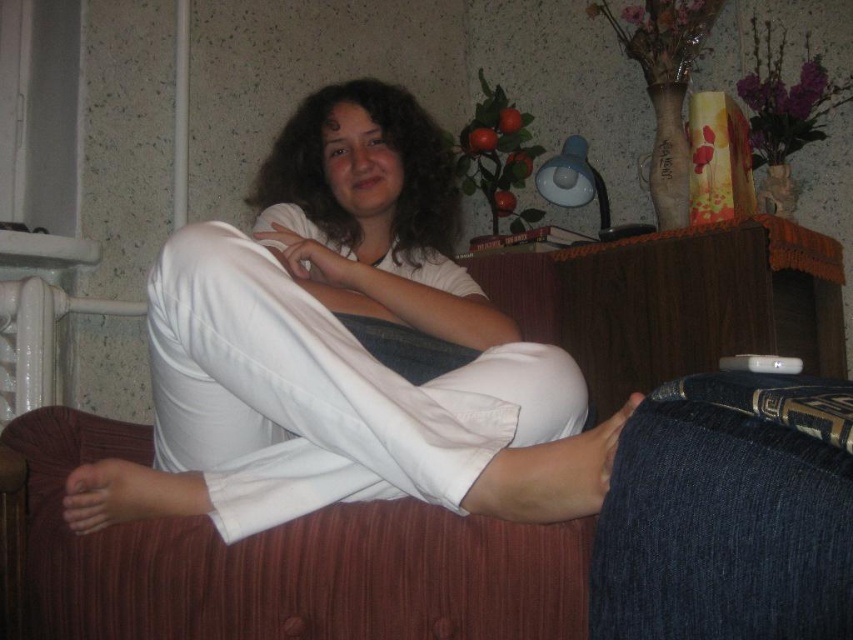
Is denim at lower right bigger than white plastic radiator at left?

Incorrect, denim at lower right is not larger than white plastic radiator at left.

Can you confirm if denim at lower right is positioned below white plastic radiator at left?

Correct, denim at lower right is located below white plastic radiator at left.

Is point (824, 556) farther from camera compared to point (16, 314)?

No, it is not.

The height and width of the screenshot is (640, 853). I want to click on denim at lower right, so click(728, 513).

Is the position of white cotton pants at center less distant than that of white plastic radiator at left?

Yes, white cotton pants at center is closer to the viewer.

Which is behind, point (546, 488) or point (42, 372)?

The point (42, 372) is behind.

Where is `white cotton pants at center`? white cotton pants at center is located at coordinates (344, 349).

Which is more to the right, denim at lower right or wooden dresser at center?

wooden dresser at center is more to the right.

Between point (727, 484) and point (712, 356), which one is positioned in front?

Point (727, 484) is in front.

The width and height of the screenshot is (853, 640). Identify the location of denim at lower right. (728, 513).

At what (x,y) coordinates should I click in order to perform the action: click on denim at lower right. Please return your answer as a coordinate pair (x, y). Looking at the image, I should click on (728, 513).